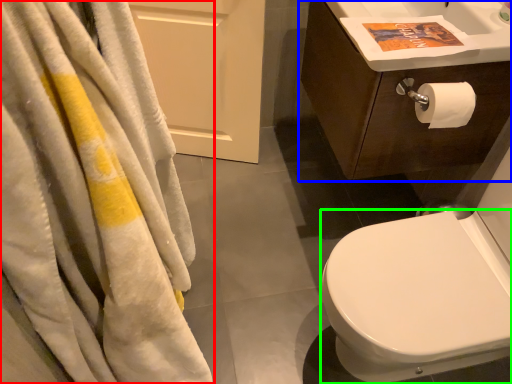
Question: Estimate the real-world distances between objects in this image. Which object is closer to towel (highlighted by a red box), bathroom cabinet (highlighted by a blue box) or bidet (highlighted by a green box)?

Choices:
 (A) bathroom cabinet
 (B) bidet

Answer: (B)